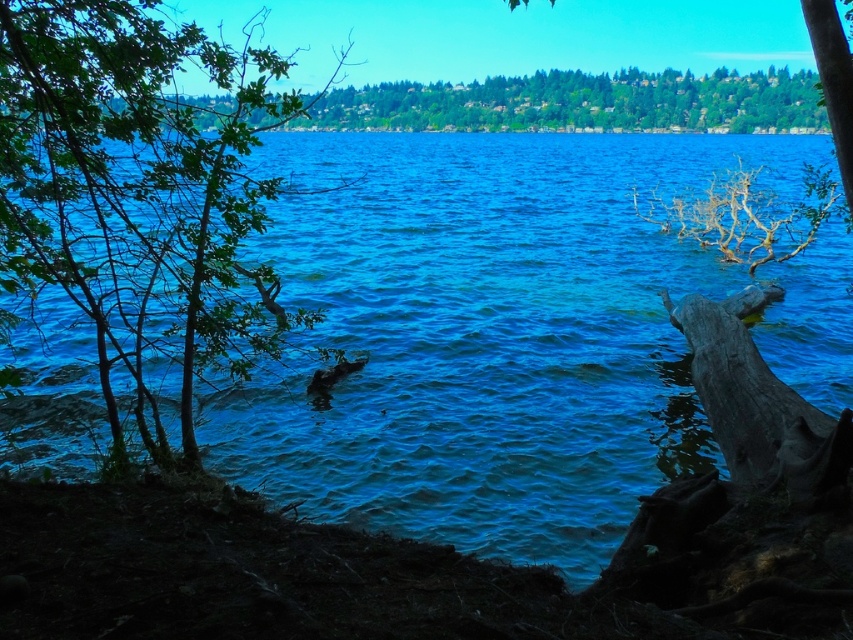
You are standing at the lakeside and see two points marked on the image. The first point is at coordinates point (732, 166) and the second point is at point (399, 83). Which point is closer to you?

Point (732, 166) is in front of point (399, 83), so the first point is closer to you.

You are standing at the lakeside and want to cross to the other side. The blue water at center is in front of you, and the green leafy tree at left is to your left. Based on their widths, which one would you say is wider?

The blue water at center is wider than the green leafy tree at left according to the description.